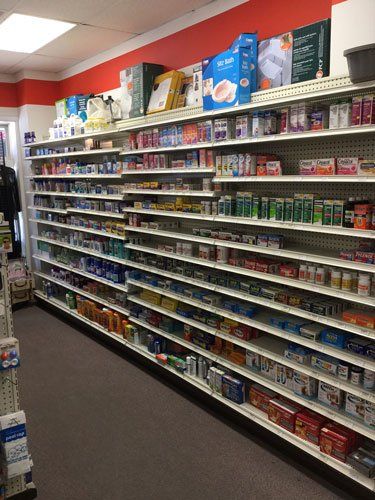
You are a GUI agent. You are given a task and a screenshot of the screen. Output one action in this format:
    pyautogui.click(x=<x>, y=<y>)
    Task: Click on the carpet
    Image resolution: width=375 pixels, height=500 pixels.
    Given the screenshot: What is the action you would take?
    pyautogui.click(x=136, y=443)